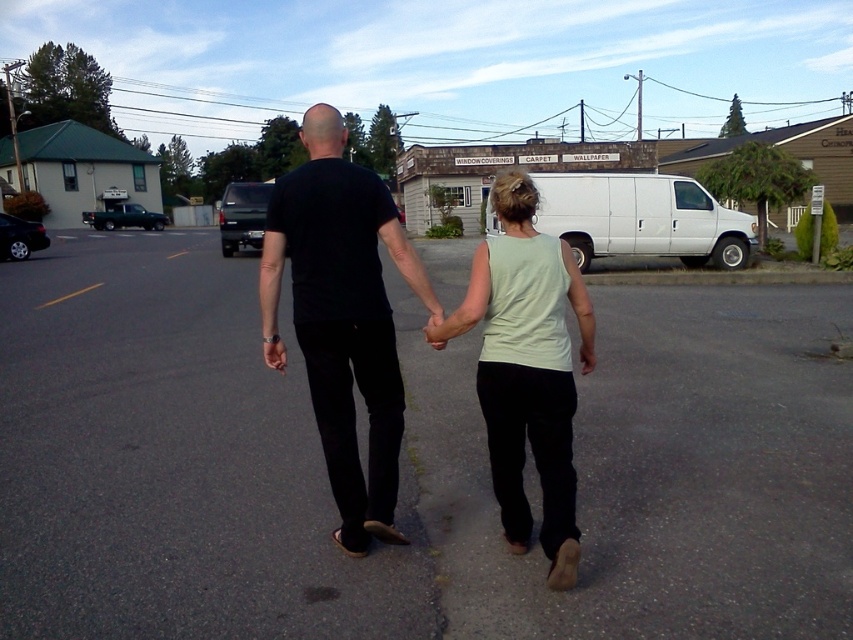
Question: Which point is closer to the camera?

Choices:
 (A) black matte shirt at center
 (B) light green sleeveless top at center
 (C) matte black hand at center

Answer: (B)

Question: Is light green sleeveless top at center positioned in front of matte black hand at center?

Choices:
 (A) no
 (B) yes

Answer: (B)

Question: Among these objects, which one is nearest to the camera?

Choices:
 (A) matte black hand at center
 (B) black matte shirt at center

Answer: (A)

Question: Which is nearer to the black matte shirt at center?

Choices:
 (A) matte black hand at center
 (B) light green sleeveless top at center

Answer: (A)

Question: Where is black matte shirt at center located in relation to matte black hand at center in the image?

Choices:
 (A) above
 (B) below

Answer: (A)

Question: In this image, where is light green sleeveless top at center located relative to matte black hand at center?

Choices:
 (A) right
 (B) left

Answer: (A)